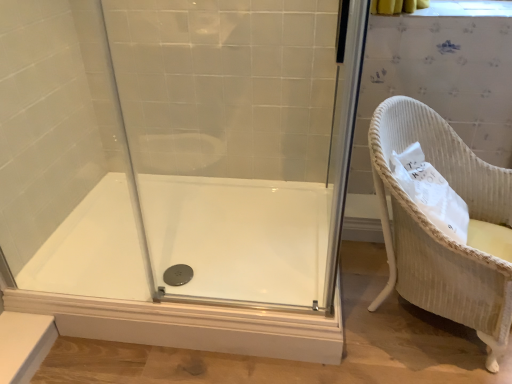
Question: From a real-world perspective, is white wicker chair at right physically below transparent glass shower door at center?

Choices:
 (A) no
 (B) yes

Answer: (B)

Question: From a real-world perspective, is white wicker chair at right located higher than transparent glass shower door at center?

Choices:
 (A) yes
 (B) no

Answer: (B)

Question: Are white wicker chair at right and transparent glass shower door at center making contact?

Choices:
 (A) no
 (B) yes

Answer: (A)

Question: Is transparent glass shower door at center a part of white wicker chair at right?

Choices:
 (A) no
 (B) yes

Answer: (A)

Question: Can we say white wicker chair at right lies outside transparent glass shower door at center?

Choices:
 (A) yes
 (B) no

Answer: (A)

Question: Is white wicker chair at right at the right side of transparent glass shower door at center?

Choices:
 (A) no
 (B) yes

Answer: (B)

Question: Considering the relative sizes of white glossy bath at center and white wicker chair at right in the image provided, is white glossy bath at center wider than white wicker chair at right?

Choices:
 (A) yes
 (B) no

Answer: (A)

Question: From the image's perspective, is white glossy bath at center on white wicker chair at right?

Choices:
 (A) yes
 (B) no

Answer: (B)

Question: Is white glossy bath at center at the left side of white wicker chair at right?

Choices:
 (A) yes
 (B) no

Answer: (A)

Question: Does white glossy bath at center have a lesser width compared to white wicker chair at right?

Choices:
 (A) no
 (B) yes

Answer: (A)

Question: Is white glossy bath at center oriented away from white wicker chair at right?

Choices:
 (A) yes
 (B) no

Answer: (B)

Question: Is white glossy bath at center located outside white wicker chair at right?

Choices:
 (A) no
 (B) yes

Answer: (B)

Question: Can you confirm if transparent glass shower door at center is shorter than white glossy bath at center?

Choices:
 (A) no
 (B) yes

Answer: (A)